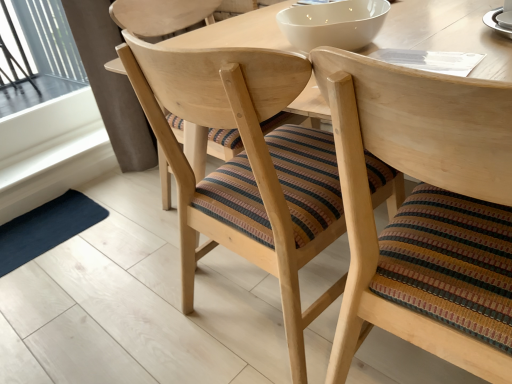
Question: Would you say white glossy saucer at upper right is outside white glossy bowl at upper center?

Choices:
 (A) yes
 (B) no

Answer: (A)

Question: Is white glossy saucer at upper right shorter than white glossy bowl at upper center?

Choices:
 (A) yes
 (B) no

Answer: (A)

Question: Is white glossy saucer at upper right bigger than white glossy bowl at upper center?

Choices:
 (A) no
 (B) yes

Answer: (A)

Question: Does white glossy saucer at upper right have a greater height compared to white glossy bowl at upper center?

Choices:
 (A) yes
 (B) no

Answer: (B)

Question: From the image's perspective, is white glossy saucer at upper right located beneath white glossy bowl at upper center?

Choices:
 (A) yes
 (B) no

Answer: (A)

Question: Considering the relative positions of white glossy saucer at upper right and white glossy bowl at upper center in the image provided, is white glossy saucer at upper right to the left of white glossy bowl at upper center from the viewer's perspective?

Choices:
 (A) no
 (B) yes

Answer: (A)

Question: Does white glossy saucer at upper right have a larger size compared to wooden chair with striped cushion at center, the first chair from the right?

Choices:
 (A) no
 (B) yes

Answer: (A)

Question: Does white glossy saucer at upper right lie behind wooden chair with striped cushion at center, the second chair viewed from the left?

Choices:
 (A) no
 (B) yes

Answer: (B)

Question: Can you see white glossy saucer at upper right touching wooden chair with striped cushion at center, the second chair viewed from the left?

Choices:
 (A) no
 (B) yes

Answer: (A)

Question: Does white glossy saucer at upper right come in front of wooden chair with striped cushion at center, the second chair viewed from the left?

Choices:
 (A) yes
 (B) no

Answer: (B)

Question: Can wooden chair with striped cushion at center, the first chair from the right, be found inside white glossy saucer at upper right?

Choices:
 (A) yes
 (B) no

Answer: (B)

Question: Considering the relative sizes of white glossy saucer at upper right and wooden chair with striped cushion at center, the second chair viewed from the left, in the image provided, is white glossy saucer at upper right shorter than wooden chair with striped cushion at center, the second chair viewed from the left,?

Choices:
 (A) no
 (B) yes

Answer: (B)

Question: From a real-world perspective, is wooden chair with striped cushion at center, which is counted as the second chair, starting from the right, located higher than white glossy bowl at upper center?

Choices:
 (A) no
 (B) yes

Answer: (A)